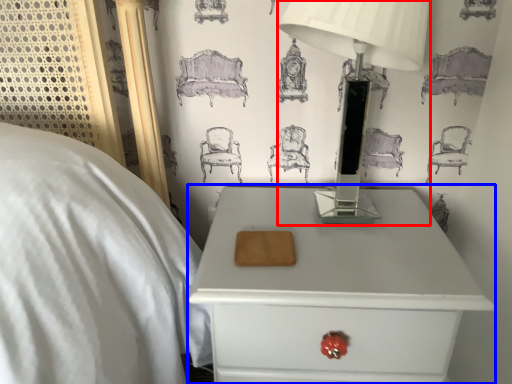
Question: Among these objects, which one is nearest to the camera, table lamp (highlighted by a red box) or nightstand (highlighted by a blue box)?

Choices:
 (A) table lamp
 (B) nightstand

Answer: (A)